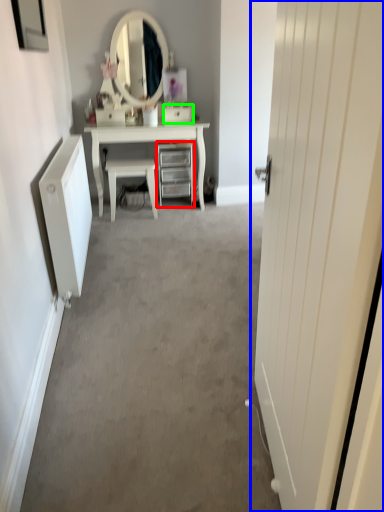
Question: Based on their relative distances, which object is farther from chest of drawers (highlighted by a red box)? Choose from door (highlighted by a blue box) and drawer (highlighted by a green box).

Choices:
 (A) door
 (B) drawer

Answer: (A)